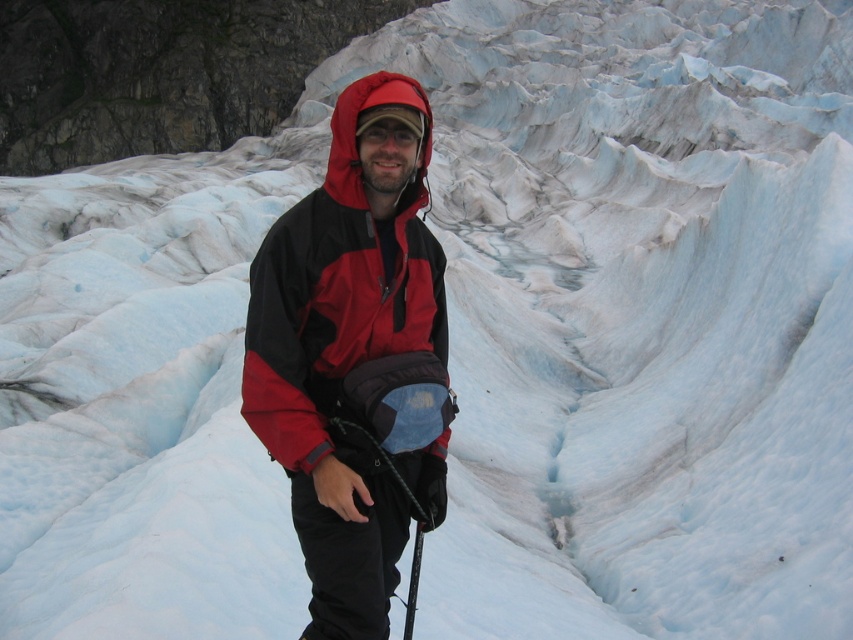
Does red matte jacket at center appear on the left side of black rubber ski pole at lower center?

Correct, you'll find red matte jacket at center to the left of black rubber ski pole at lower center.

Is point (280, 307) positioned in front of point (415, 540)?

That is True.

Find the location of `red matte jacket at center`. red matte jacket at center is located at coordinates pyautogui.click(x=341, y=280).